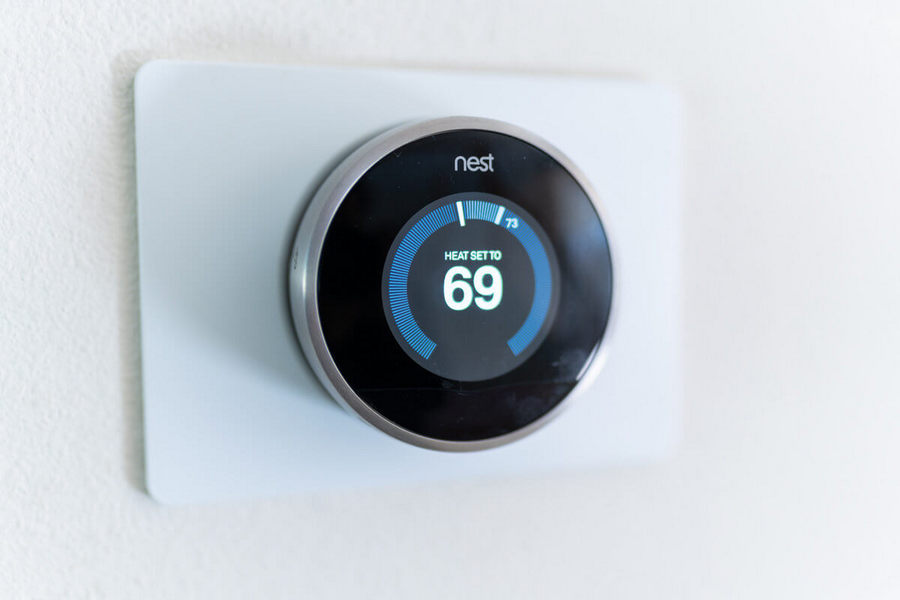
Identify the location of white wall. (55, 166).